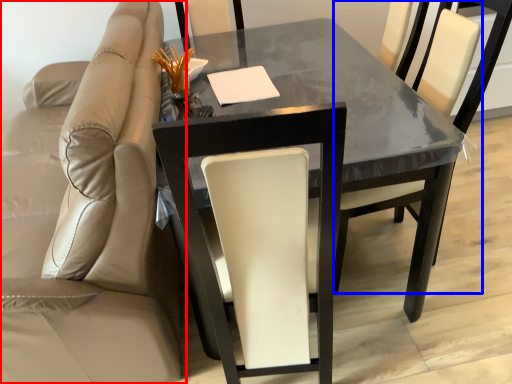
Question: Which point is closer to the camera, chair (highlighted by a red box) or chair (highlighted by a blue box)?

Choices:
 (A) chair
 (B) chair

Answer: (A)